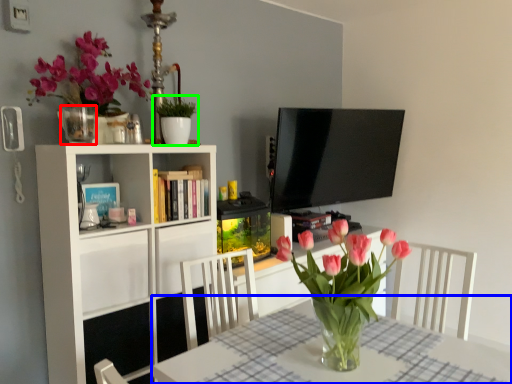
Question: Which is nearer to the vase (highlighted by a red box)? table (highlighted by a blue box) or houseplant (highlighted by a green box).

Choices:
 (A) table
 (B) houseplant

Answer: (B)